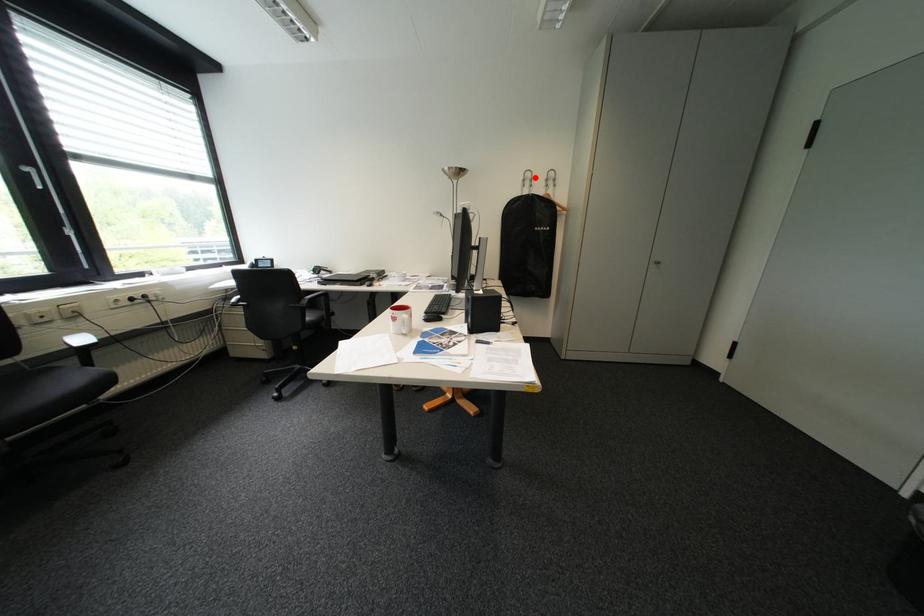
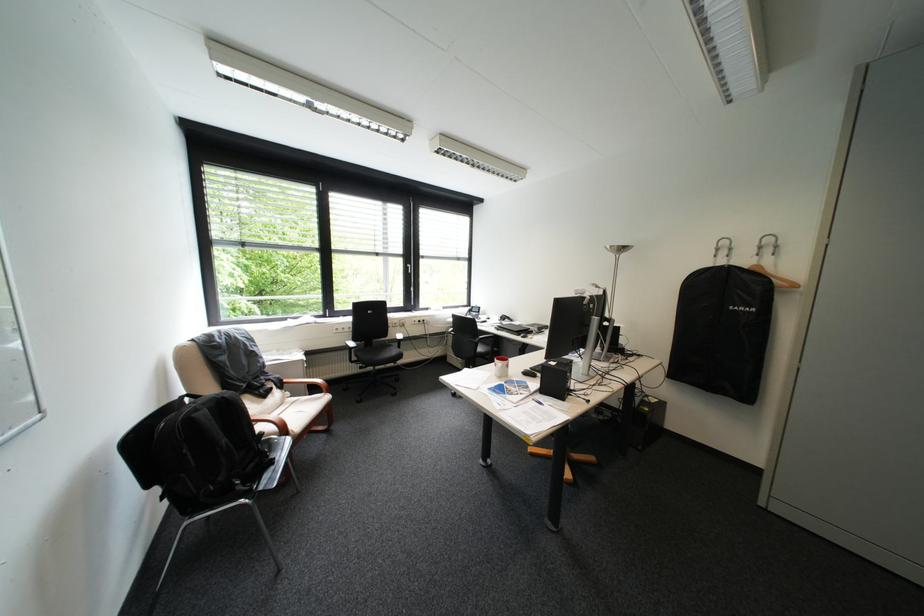
Question: I am providing you with two images of the same scene from different viewpoints. Given a red point in image1, look at the same physical point in image2. Is it:

Choices:
 (A) Closer to the viewpoint
 (B) Farther from the viewpoint

Answer: (B)